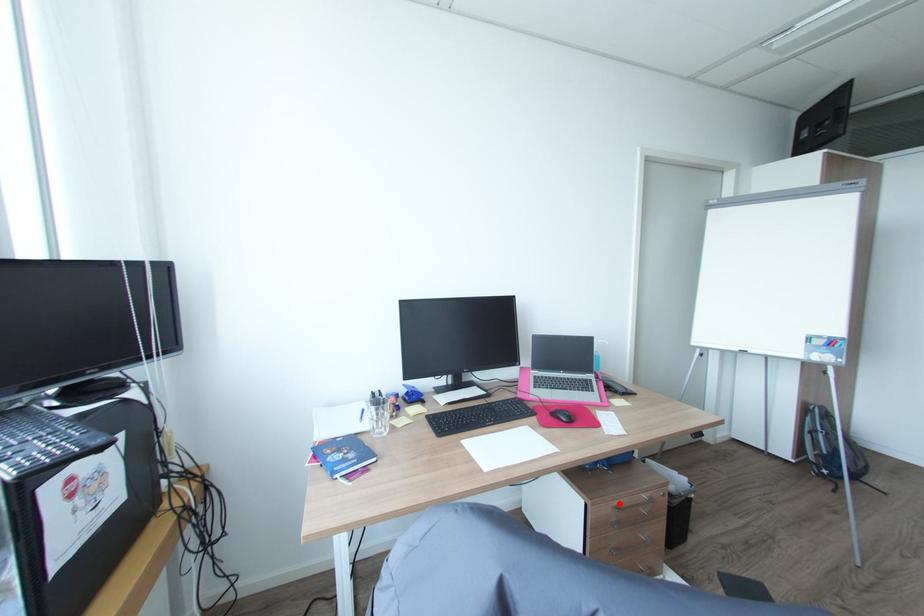
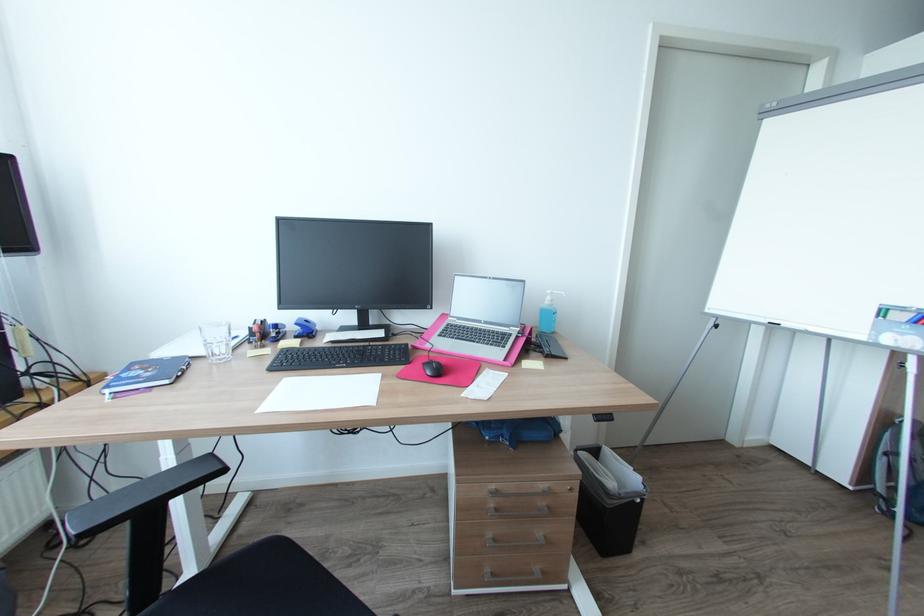
Where in the second image is the point corresponding to the highlighted location from the first image?

(497, 487)